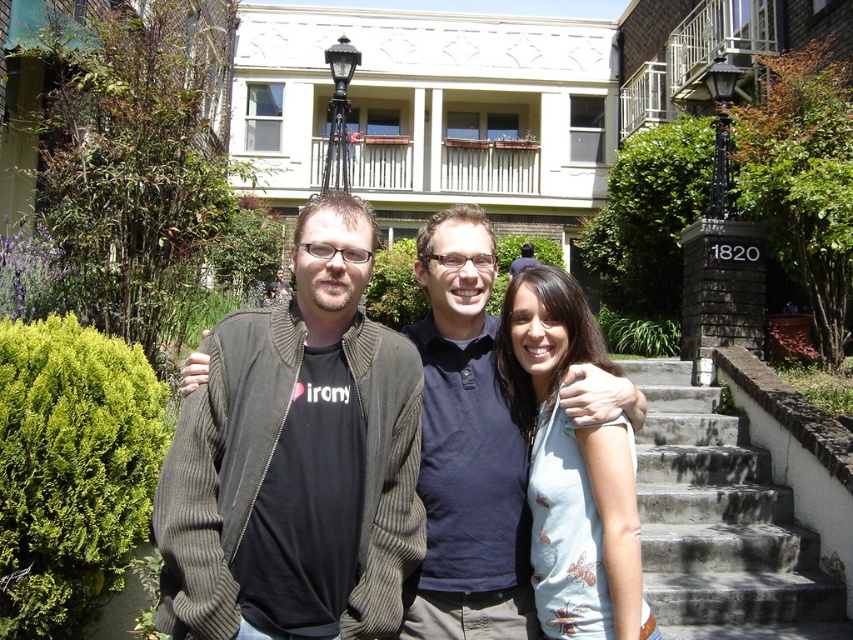
Question: Which of the following is the farthest from the observer?

Choices:
 (A) black wrought iron lamp post at upper center
 (B) dark gray sweater at center

Answer: (A)

Question: Estimate the real-world distances between objects in this image. Which object is closer to the dark gray sweater at center?

Choices:
 (A) black wrought iron lamp post at upper right
 (B) concrete/stained at right

Answer: (B)

Question: Does dark gray sweater at center have a greater width compared to light blue cotton shirt at center?

Choices:
 (A) yes
 (B) no

Answer: (A)

Question: Which point is closer to the camera?

Choices:
 (A) (503, 592)
 (B) (741, 417)
 (C) (726, 198)
 (D) (579, 628)

Answer: (D)

Question: Is dark gray sweater at center closer to camera compared to light blue cotton shirt at center?

Choices:
 (A) yes
 (B) no

Answer: (B)

Question: Can you confirm if concrete/stained at right is positioned to the right of black wrought iron lamp post at upper center?

Choices:
 (A) no
 (B) yes

Answer: (B)